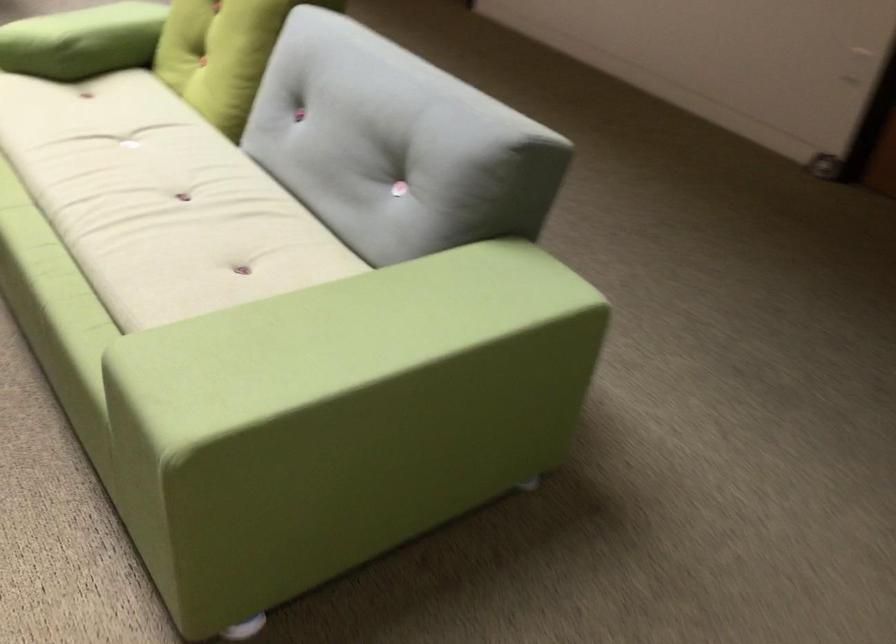
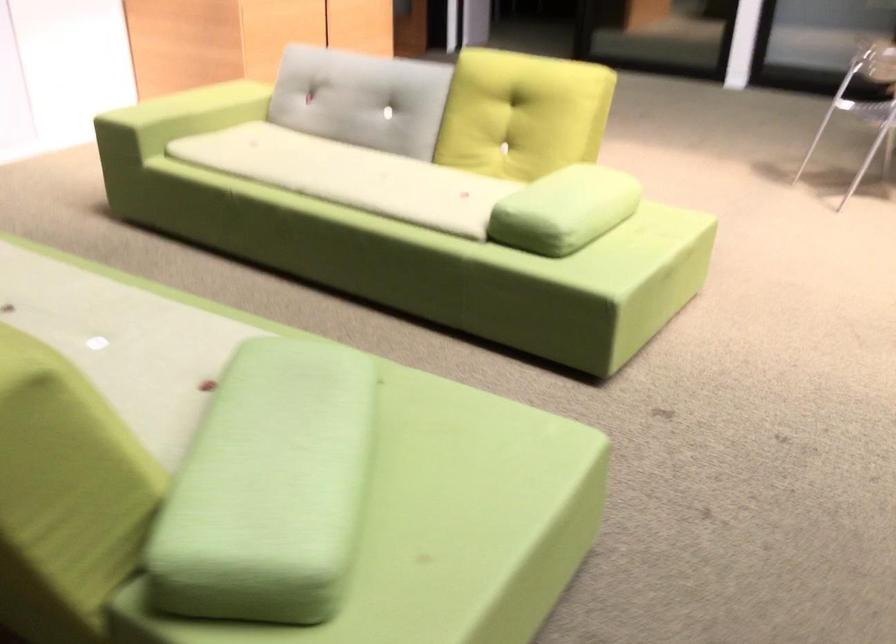
Where in the second image is the point corresponding to [131,175] from the first image?

(66, 290)